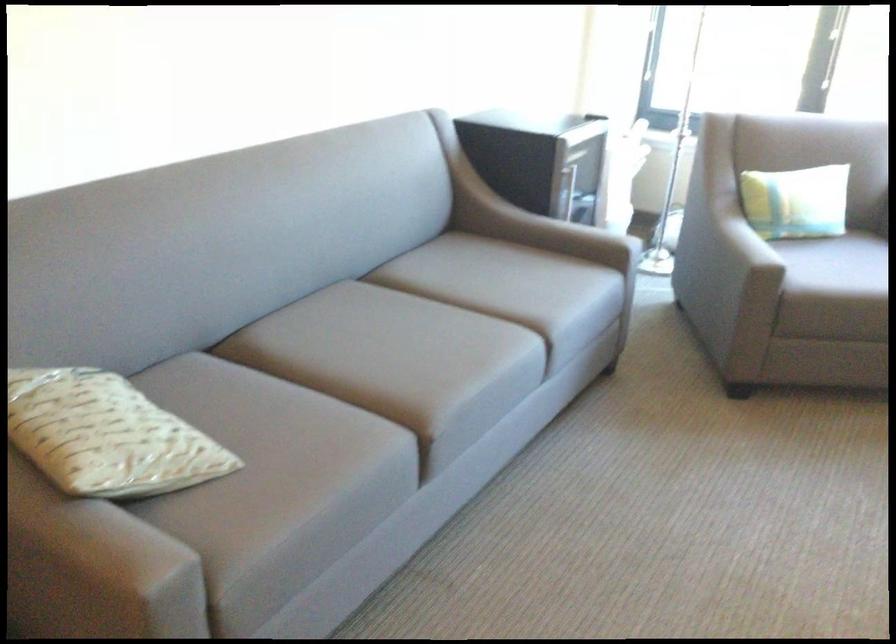
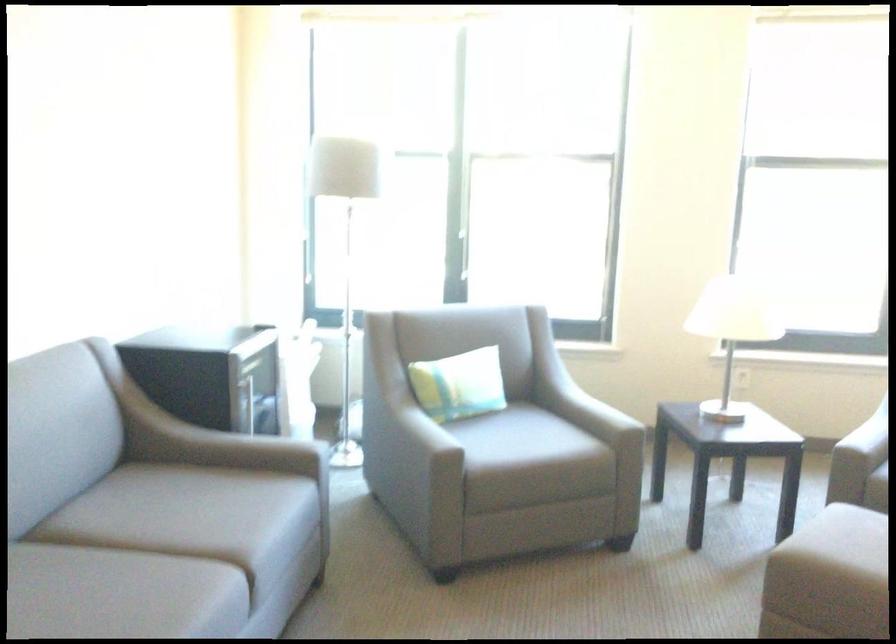
Question: How did the camera likely rotate?

Choices:
 (A) Left
 (B) Right
 (C) Up
 (D) Down

Answer: (B)